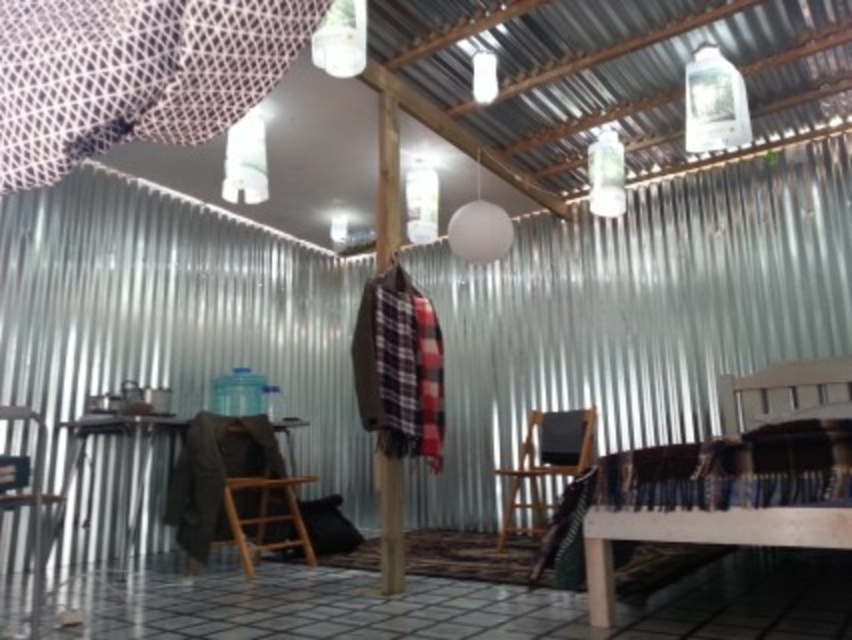
Who is more forward, (689,509) or (691,132)?

Point (689,509) is more forward.

At what (x,y) coordinates should I click in order to perform the action: click on wooden bed at lower right. Please return your answer as a coordinate pair (x, y). The width and height of the screenshot is (852, 640). Looking at the image, I should click on (699, 538).

Find the location of a particular element. The image size is (852, 640). wooden bed at lower right is located at coordinates (699, 538).

This screenshot has width=852, height=640. Identify the location of wooden bed at lower right. (699, 538).

Which of these two, wooden bed at lower right or wooden chair at left, stands taller?

wooden chair at left

Can you confirm if wooden bed at lower right is taller than wooden chair at left?

In fact, wooden bed at lower right may be shorter than wooden chair at left.

Find the location of `wooden bed at lower right`. wooden bed at lower right is located at coordinates [x=699, y=538].

Does wooden chair at center have a greater width compared to translucent glass lampshade at upper center?

Yes.

Does wooden chair at center have a smaller size compared to translucent glass lampshade at upper center?

Incorrect, wooden chair at center is not smaller in size than translucent glass lampshade at upper center.

Locate an element on the screen. This screenshot has height=640, width=852. wooden chair at center is located at coordinates (545, 461).

Locate an element on the screen. The image size is (852, 640). wooden chair at center is located at coordinates (545, 461).